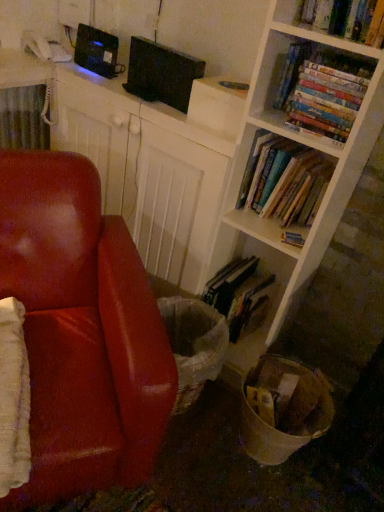
Question: Considering the relative positions of hardcover books at center right, arranged as the 2th book when viewed from the top, and hardcover book at lower center, the first book positioned from the bottom, in the image provided, is hardcover books at center right, arranged as the 2th book when viewed from the top, in front of hardcover book at lower center, the first book positioned from the bottom,?

Choices:
 (A) yes
 (B) no

Answer: (A)

Question: From a real-world perspective, is hardcover books at center right, which is counted as the third book, starting from the bottom, on hardcover book at lower center, the first book positioned from the bottom?

Choices:
 (A) yes
 (B) no

Answer: (A)

Question: Is hardcover books at center right, arranged as the 2th book when viewed from the top, further to the viewer compared to hardcover book at lower center, which is the 4th book from top to bottom?

Choices:
 (A) no
 (B) yes

Answer: (A)

Question: Is hardcover books at center right, arranged as the 2th book when viewed from the top, completely or partially outside of hardcover book at lower center, which is the 4th book from top to bottom?

Choices:
 (A) yes
 (B) no

Answer: (A)

Question: Is hardcover book at lower center, which is the 4th book from top to bottom, completely or partially inside hardcover books at center right, which is counted as the third book, starting from the bottom?

Choices:
 (A) yes
 (B) no

Answer: (B)

Question: From the image's perspective, does hardcover books at center right, arranged as the 2th book when viewed from the top, appear higher than hardcover book at lower center, which is the 4th book from top to bottom?

Choices:
 (A) no
 (B) yes

Answer: (B)

Question: From a real-world perspective, is hardcover book at lower center, which is the 4th book from top to bottom, positioned over hardcover books at upper right, acting as the fourth book starting from the bottom, based on gravity?

Choices:
 (A) no
 (B) yes

Answer: (A)

Question: Is hardcover book at lower center, which is the 4th book from top to bottom, to the left of hardcover books at upper right, acting as the fourth book starting from the bottom, from the viewer's perspective?

Choices:
 (A) no
 (B) yes

Answer: (B)

Question: From the image's perspective, is hardcover book at lower center, which is the 4th book from top to bottom, above hardcover books at upper right, which appears as the 1th book when viewed from the top?

Choices:
 (A) yes
 (B) no

Answer: (B)

Question: Is hardcover book at lower center, the first book positioned from the bottom, shorter than hardcover books at upper right, which appears as the 1th book when viewed from the top?

Choices:
 (A) no
 (B) yes

Answer: (A)

Question: Is hardcover book at lower center, the first book positioned from the bottom, positioned with its back to hardcover books at upper right, which appears as the 1th book when viewed from the top?

Choices:
 (A) no
 (B) yes

Answer: (A)

Question: Does hardcover book at lower center, the first book positioned from the bottom, come behind hardcover books at upper right, which appears as the 1th book when viewed from the top?

Choices:
 (A) yes
 (B) no

Answer: (A)

Question: Is black matte computer at upper center surrounding hardcover books at upper right, which appears as the 1th book when viewed from the top?

Choices:
 (A) no
 (B) yes

Answer: (A)